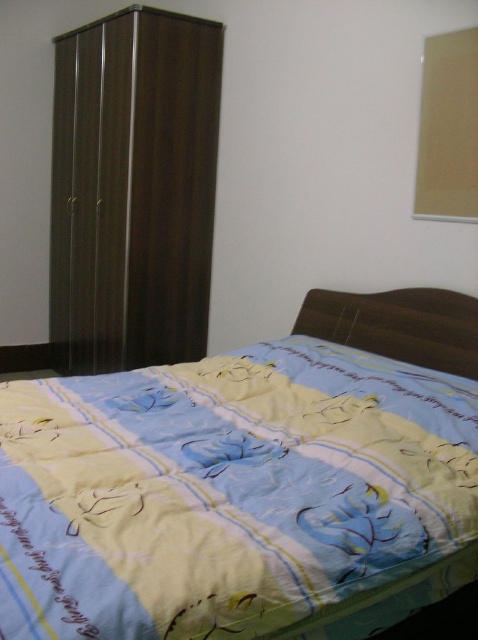
Question: Is dark wood wardrobe at left to the right of yellow printed fabric bed at lower left from the viewer's perspective?

Choices:
 (A) no
 (B) yes

Answer: (A)

Question: Where is dark wood wardrobe at left located in relation to yellow printed fabric bed at lower left in the image?

Choices:
 (A) above
 (B) below

Answer: (A)

Question: Is dark wood wardrobe at left to the right of yellow printed fabric bed at lower left from the viewer's perspective?

Choices:
 (A) yes
 (B) no

Answer: (B)

Question: Which point is closer to the camera?

Choices:
 (A) (358, 301)
 (B) (131, 358)

Answer: (A)

Question: Which object is farther from the camera taking this photo?

Choices:
 (A) yellow printed fabric bed at lower left
 (B) dark wood wardrobe at left

Answer: (B)